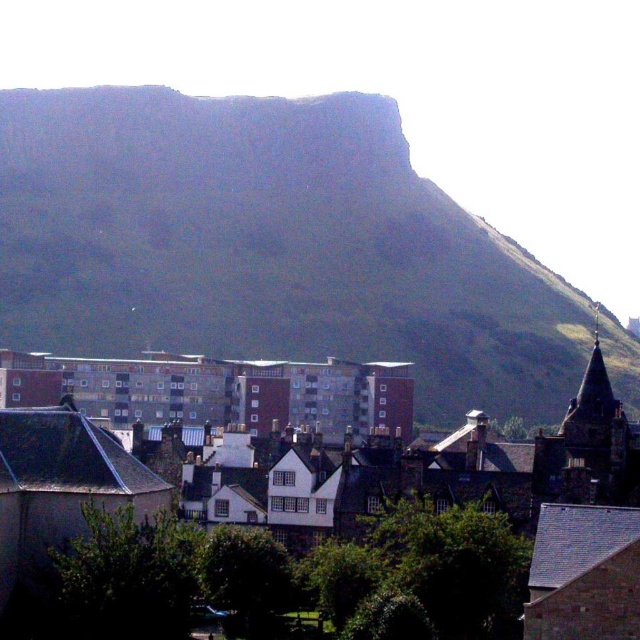
You are a drone operator who needs to fly a drone from the green grassy hill at upper center to the brown brick town at center. What is the approximate distance you need to cover?

The green grassy hill at upper center and brown brick town at center are 181.11 meters apart, so the drone needs to cover approximately 181.11 meters.

You are a city planner evaluating the urban layout. Given the green grassy hill at upper center and the brick apartment building at center, which one has a greater horizontal span from left to right?

The green grassy hill at upper center has a greater horizontal span from left to right than the brick apartment building at center because its width surpasses that of the brick apartment building at center.